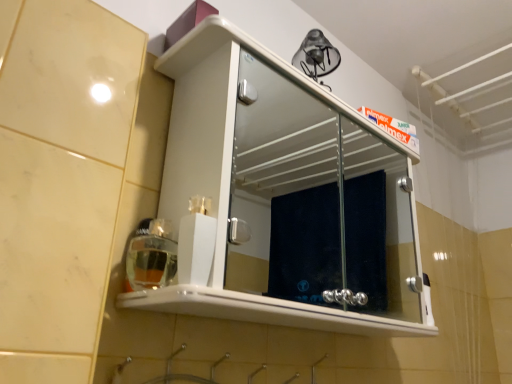
Looking at this image, measure the distance between white glossy cabinet at upper center and camera.

4.11 feet.

Image resolution: width=512 pixels, height=384 pixels. In order to click on white glossy cabinet at upper center in this screenshot , I will do `click(276, 192)`.

This screenshot has height=384, width=512. What do you see at coordinates (276, 192) in the screenshot? I see `white glossy cabinet at upper center` at bounding box center [276, 192].

The image size is (512, 384). Describe the element at coordinates (151, 256) in the screenshot. I see `translucent plastic soap dispenser at lower left` at that location.

In order to face translucent plastic soap dispenser at lower left, should I rotate leftwards or rightwards?

A 12.986 degree turn to the left will do.

The image size is (512, 384). Find the location of `translucent plastic soap dispenser at lower left`. translucent plastic soap dispenser at lower left is located at coordinates (151, 256).

The width and height of the screenshot is (512, 384). I want to click on white glossy cabinet at upper center, so click(x=276, y=192).

Is white glossy cabinet at upper center at the left side of translucent plastic soap dispenser at lower left?

Incorrect, white glossy cabinet at upper center is not on the left side of translucent plastic soap dispenser at lower left.

Which object is further away from the camera, white glossy cabinet at upper center or translucent plastic soap dispenser at lower left?

translucent plastic soap dispenser at lower left is further from the camera.

Which is behind, point (182, 175) or point (146, 288)?

The point (182, 175) is behind.

From the image's perspective, which is below, white glossy cabinet at upper center or translucent plastic soap dispenser at lower left?

translucent plastic soap dispenser at lower left is shown below in the image.

Consider the image. From a real-world perspective, which is physically above, white glossy cabinet at upper center or translucent plastic soap dispenser at lower left?

In real-world perspective, white glossy cabinet at upper center is above.

Which object is wider, white glossy cabinet at upper center or translucent plastic soap dispenser at lower left?

white glossy cabinet at upper center is wider.

Considering the sizes of objects white glossy cabinet at upper center and translucent plastic soap dispenser at lower left in the image provided, who is taller, white glossy cabinet at upper center or translucent plastic soap dispenser at lower left?

With more height is white glossy cabinet at upper center.

Considering the sizes of objects white glossy cabinet at upper center and translucent plastic soap dispenser at lower left in the image provided, who is bigger, white glossy cabinet at upper center or translucent plastic soap dispenser at lower left?

Bigger between the two is white glossy cabinet at upper center.

From the picture: Is white glossy cabinet at upper center situated inside translucent plastic soap dispenser at lower left or outside?

white glossy cabinet at upper center lies outside translucent plastic soap dispenser at lower left.

Does white glossy cabinet at upper center touch translucent plastic soap dispenser at lower left?

No, white glossy cabinet at upper center is not touching translucent plastic soap dispenser at lower left.

Is white glossy cabinet at upper center positioned with its back to translucent plastic soap dispenser at lower left?

Yes, white glossy cabinet at upper center is facing away from translucent plastic soap dispenser at lower left.

How much distance is there between white glossy cabinet at upper center and translucent plastic soap dispenser at lower left?

A distance of 1.33 meters exists between white glossy cabinet at upper center and translucent plastic soap dispenser at lower left.

In order to click on cabinetry above the translucent plastic soap dispenser at lower left (from the image's perspective) in this screenshot , I will do point(276,192).

Considering the relative positions of translucent plastic soap dispenser at lower left and white glossy cabinet at upper center in the image provided, is translucent plastic soap dispenser at lower left to the right of white glossy cabinet at upper center from the viewer's perspective?

No.

Which is in front, translucent plastic soap dispenser at lower left or white glossy cabinet at upper center?

white glossy cabinet at upper center.

Which is behind, point (132, 285) or point (348, 213)?

Positioned behind is point (348, 213).

From the image's perspective, which is below, translucent plastic soap dispenser at lower left or white glossy cabinet at upper center?

translucent plastic soap dispenser at lower left, from the image's perspective.

From a real-world perspective, is translucent plastic soap dispenser at lower left above or below white glossy cabinet at upper center?

From a real-world perspective, translucent plastic soap dispenser at lower left is physically below white glossy cabinet at upper center.

Which of these two, translucent plastic soap dispenser at lower left or white glossy cabinet at upper center, is thinner?

Thinner between the two is translucent plastic soap dispenser at lower left.

Who is shorter, translucent plastic soap dispenser at lower left or white glossy cabinet at upper center?

With less height is translucent plastic soap dispenser at lower left.

Who is bigger, translucent plastic soap dispenser at lower left or white glossy cabinet at upper center?

white glossy cabinet at upper center.

Is translucent plastic soap dispenser at lower left surrounding white glossy cabinet at upper center?

No, translucent plastic soap dispenser at lower left does not contain white glossy cabinet at upper center.

Are translucent plastic soap dispenser at lower left and white glossy cabinet at upper center making contact?

No, translucent plastic soap dispenser at lower left is not with white glossy cabinet at upper center.

Is white glossy cabinet at upper center at the back of translucent plastic soap dispenser at lower left?

Yes, translucent plastic soap dispenser at lower left's orientation is away from white glossy cabinet at upper center.

How different are the orientations of translucent plastic soap dispenser at lower left and white glossy cabinet at upper center in degrees?

There is a 2.19-degree angle between the facing directions of translucent plastic soap dispenser at lower left and white glossy cabinet at upper center.

Could you measure the distance between translucent plastic soap dispenser at lower left and white glossy cabinet at upper center?

A distance of 4.35 feet exists between translucent plastic soap dispenser at lower left and white glossy cabinet at upper center.

The width and height of the screenshot is (512, 384). I want to click on soap dispenser below the white glossy cabinet at upper center (from the image's perspective), so [x=151, y=256].

Identify the location of cabinetry that is in front of the translucent plastic soap dispenser at lower left. Image resolution: width=512 pixels, height=384 pixels. (276, 192).

Find the location of a particular element. cabinetry that is above the translucent plastic soap dispenser at lower left (from the image's perspective) is located at coordinates (276, 192).